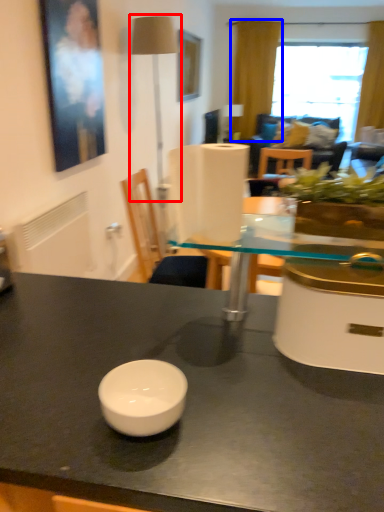
Question: Which object is closer to the camera taking this photo, table lamp (highlighted by a red box) or curtain (highlighted by a blue box)?

Choices:
 (A) table lamp
 (B) curtain

Answer: (A)